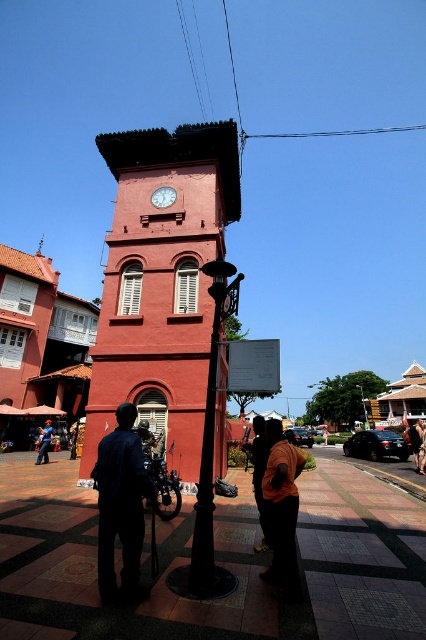
Question: Among these points, which one is farthest from the camera?

Choices:
 (A) (126, 556)
 (B) (245, 444)
 (C) (265, 516)

Answer: (B)

Question: Which of the following is the farthest from the observer?

Choices:
 (A) (259, 493)
 (B) (270, 444)
 (C) (115, 380)

Answer: (C)

Question: Among these points, which one is nearest to the camera?

Choices:
 (A) (264, 436)
 (B) (143, 467)
 (C) (362, 404)
 (D) (132, 326)

Answer: (B)

Question: Is dark blue fabric at lower left thinner than orange cotton shirt at center?

Choices:
 (A) no
 (B) yes

Answer: (A)

Question: Does dark blue fabric at lower left appear on the left side of dark brown leather jacket at lower right?

Choices:
 (A) no
 (B) yes

Answer: (B)

Question: Does dark blue fabric at lower left have a smaller size compared to matte red clock at center?

Choices:
 (A) yes
 (B) no

Answer: (B)